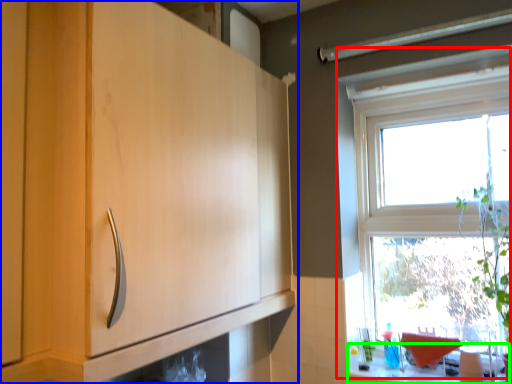
Question: Considering the real-world distances, which object is closest to window (highlighted by a red box)? cabinetry (highlighted by a blue box) or counter top (highlighted by a green box).

Choices:
 (A) cabinetry
 (B) counter top

Answer: (B)